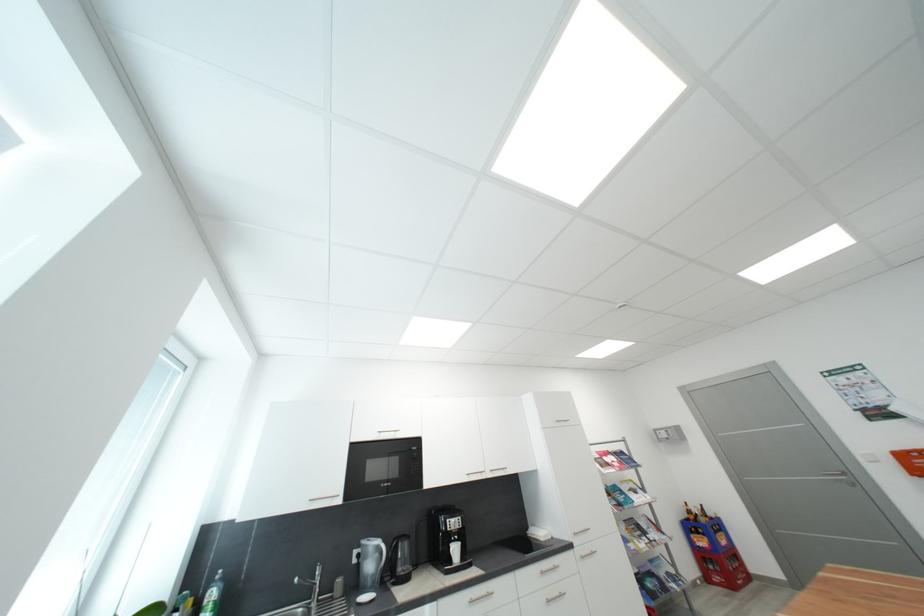
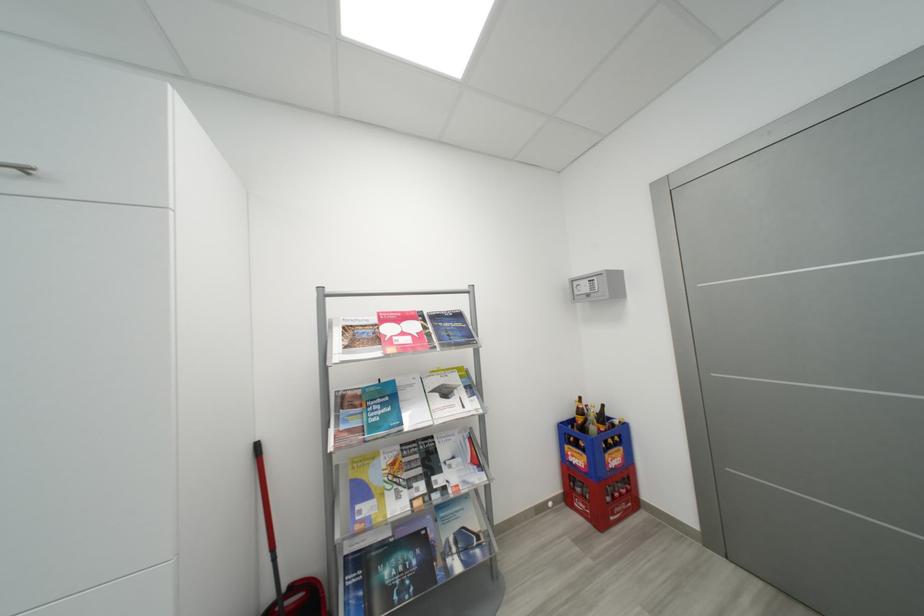
What movement of the cameraman would produce the second image?

The cameraman moved toward right, forward.